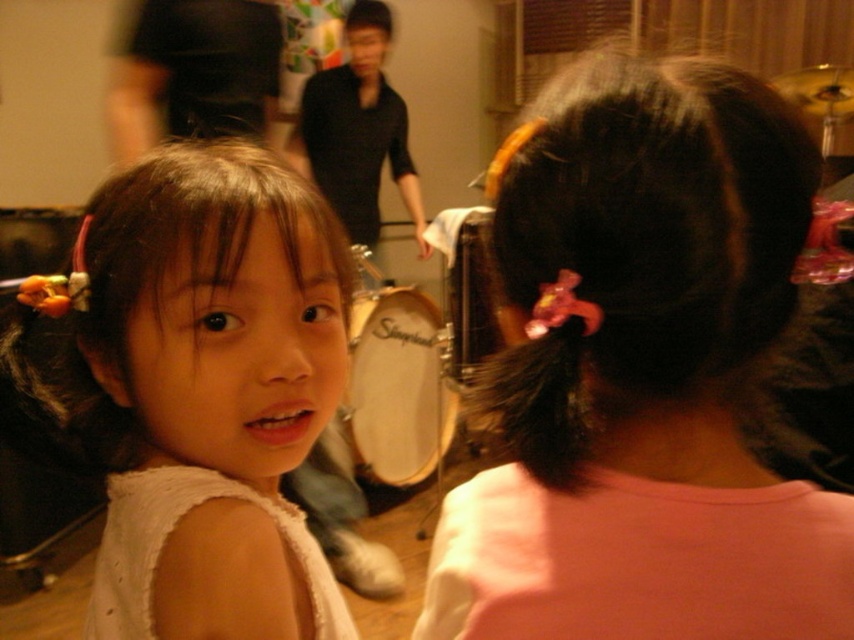
You are standing in the music practice session scene. There is a point at coordinates point (196, 461). Can you reach that point with your hand if you extend it fully?

The distance between point (196, 461) and the viewer is 19.74 inches. Since the average human arm length is about 25 inches, you can reach the point by extending your arm fully.

You are a photographer setting up for a photoshoot in this room. You need to place a spotlight at position point 0.609, 0.237 to highlight the matte white dress at left. Where should you aim the spotlight?

The matte white dress at left is located at point (202, 388), so you should aim the spotlight at that coordinate to highlight it.